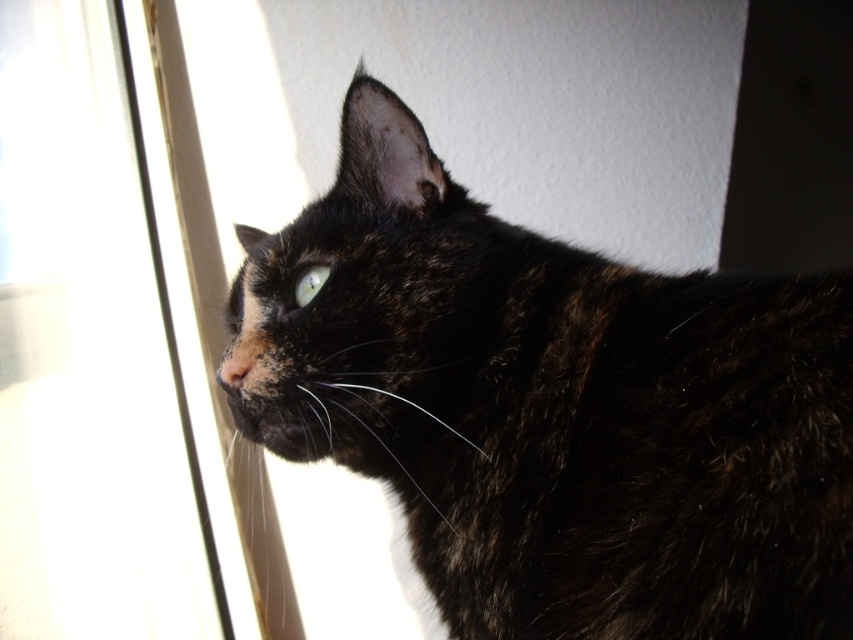
You are a cat owner trying to determine if your cat can see through the transparent glass window at left while looking at the shiny green eye at upper center. Based on the scene, can your cat see through the window?

The transparent glass window at left is bigger than the shiny green eye at upper center, so the cat can see through the transparent glass window at left as long as its eye is aligned with the window.

From the picture: You are holding a 36 inch long fishing rod and want to reach the point marked at point (740,284) through the window. Can you reach it with your rod?

The distance between you and point (740,284) is 38.55 inches, so yes, you can reach it with your 36 inch rod since it is shorter than the distance.

You are a photographer trying to capture a closeup of the tortoiseshell fur cat at upper left and the shiny green eye at upper center. Which object should you focus on first if you want to ensure both are in frame without moving the camera?

The tortoiseshell fur cat at upper left is wider than the shiny green eye at upper center, so focusing on the wider object first would allow you to adjust the frame to include both.